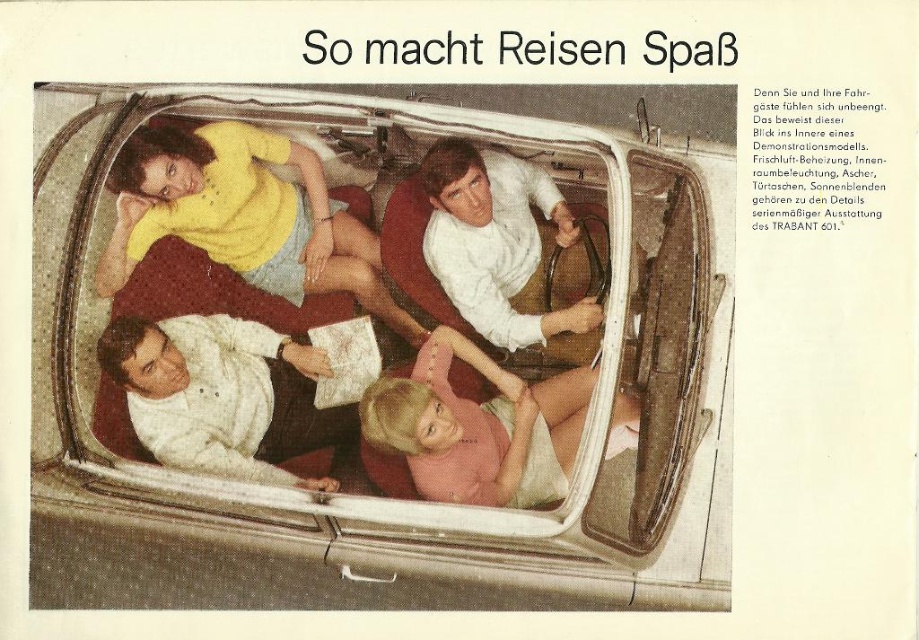
Question: Can you confirm if pink fabric at center is bigger than white smooth shirt at center?

Choices:
 (A) no
 (B) yes

Answer: (A)

Question: Does pink fabric at center appear over white smooth shirt at center?

Choices:
 (A) yes
 (B) no

Answer: (B)

Question: Which of the following is the farthest from the observer?

Choices:
 (A) (297, 340)
 (B) (517, 321)

Answer: (A)

Question: Which point is closer to the camera?

Choices:
 (A) white smooth shirt at center
 (B) white textured shirt at lower left
 (C) pink fabric at center

Answer: (C)

Question: From the image, what is the correct spatial relationship of beige fabric car at center in relation to yellow fabric shirt at upper left?

Choices:
 (A) below
 (B) above

Answer: (A)

Question: Considering the real-world distances, which object is farthest from the beige fabric car at center?

Choices:
 (A) white textured shirt at lower left
 (B) pink fabric at center

Answer: (B)